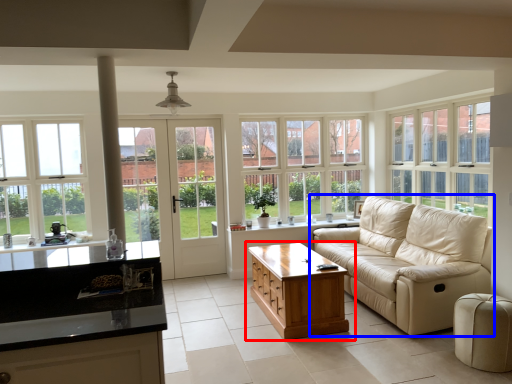
Question: Which point is further to the camera, table (highlighted by a red box) or studio couch (highlighted by a blue box)?

Choices:
 (A) table
 (B) studio couch

Answer: (A)